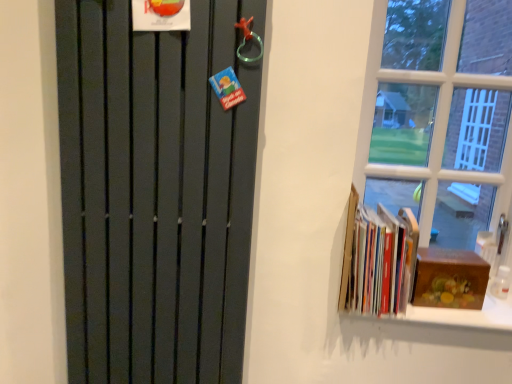
Identify the location of free space in front of wooden box at right. Image resolution: width=512 pixels, height=384 pixels. (455, 322).